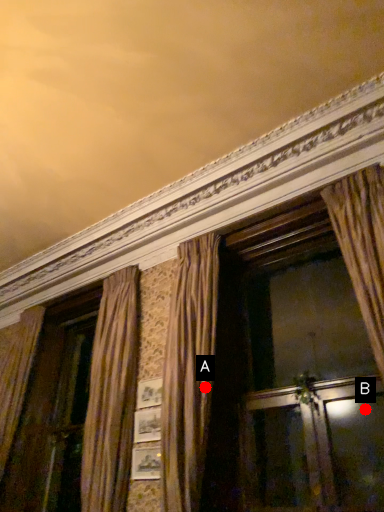
Question: Two points are circled on the image, labeled by A and B beside each circle. Which point is closer to the camera?

Choices:
 (A) A is closer
 (B) B is closer

Answer: (B)